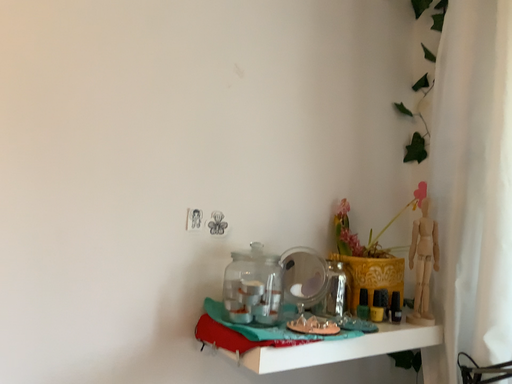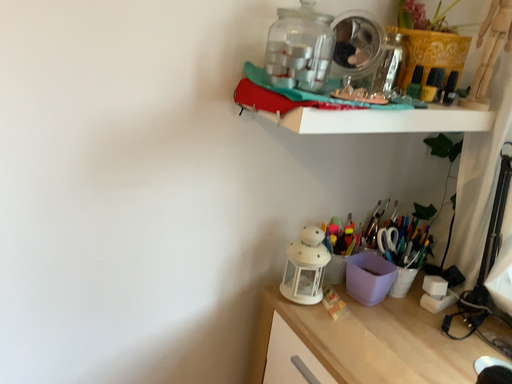
Question: Which way did the camera rotate in the video?

Choices:
 (A) rotated upward
 (B) rotated downward

Answer: (B)